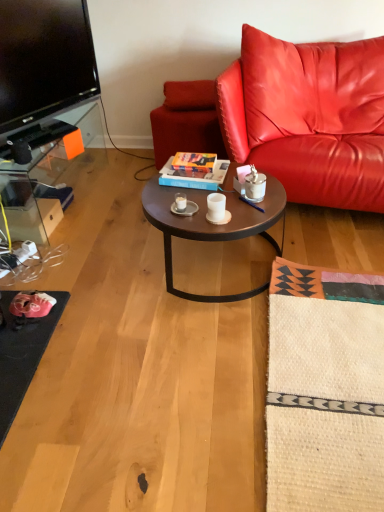
Question: Is white ceramic mug at center, which ranks as the 1th coffee cup in left-to-right order, in front of or behind leather cushion at upper center in the image?

Choices:
 (A) behind
 (B) front

Answer: (B)

Question: From the image's perspective, is white ceramic mug at center, which ranks as the 1th coffee cup in left-to-right order, above or below leather cushion at upper center?

Choices:
 (A) below
 (B) above

Answer: (A)

Question: Which object is the closest to the matte leather swivel chair at center?

Choices:
 (A) leather couch at right
 (B) dark brown wood coffee table at center
 (C) metallic pen at center
 (D) leather cushion at upper center
 (E) white matte cup at center, which is the second coffee cup in back-to-front order

Answer: (D)

Question: Which object is the closest to the white matte cup at center, which ranks as the 2th coffee cup in left-to-right order?

Choices:
 (A) dark brown wood coffee table at center
 (B) metallic pen at center
 (C) white ceramic mug at center, the 2th coffee cup from the front
 (D) leather cushion at upper center
 (E) leather couch at right

Answer: (C)